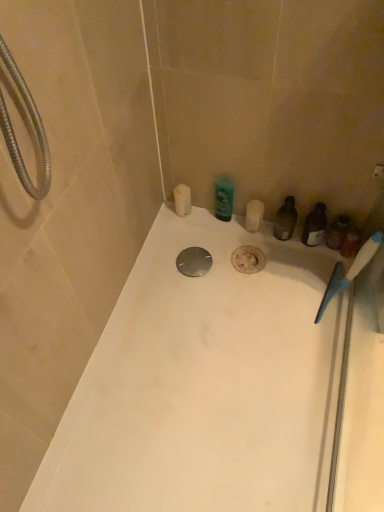
You are a GUI agent. You are given a task and a screenshot of the screen. Output one action in this format:
    pyautogui.click(x=<x>, y=<y>)
    Task: Click on the free area in between blue plastic toothbrush at right and white matte candle at upper left, the first toiletry from the left
    This screenshot has width=384, height=512.
    Given the screenshot: What is the action you would take?
    pyautogui.click(x=262, y=264)